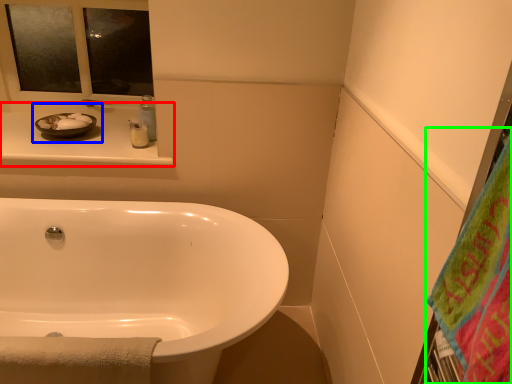
Question: Which object is the farthest from counter top (highlighted by a red box)? Choose among these: sink (highlighted by a blue box) or beach towel (highlighted by a green box).

Choices:
 (A) sink
 (B) beach towel

Answer: (B)